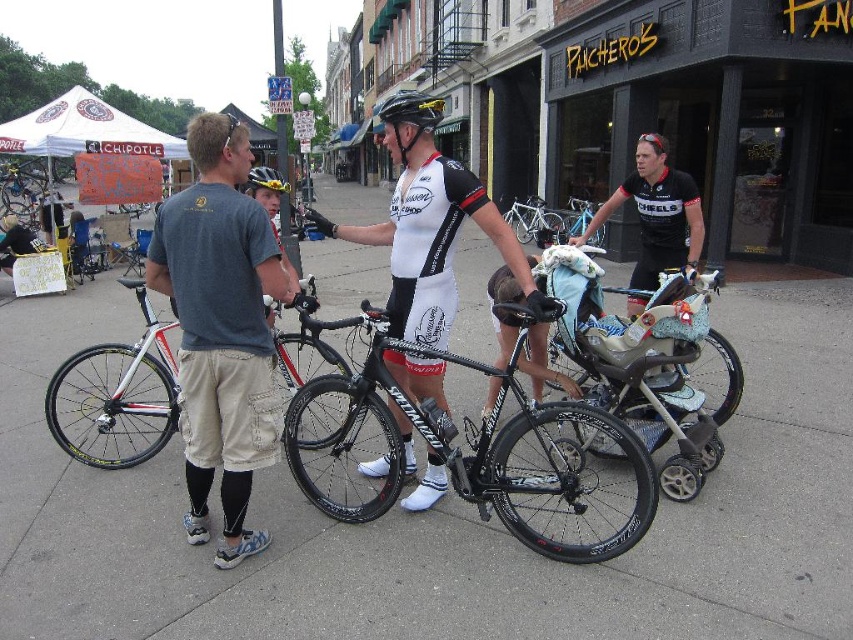
Does shiny black frame at center have a greater height compared to white matte cycling jersey at center?

Correct, shiny black frame at center is much taller as white matte cycling jersey at center.

This screenshot has height=640, width=853. I want to click on shiny black frame at center, so click(469, 445).

Locate an element on the screen. This screenshot has width=853, height=640. shiny black frame at center is located at coordinates (469, 445).

Does gray concrete pavement at center appear on the right side of white matte bicycle at left?

Indeed, gray concrete pavement at center is positioned on the right side of white matte bicycle at left.

Who is more forward, [810,340] or [70,440]?

Point [70,440] is in front.

Is point (144, 481) closer to viewer compared to point (149, 449)?

Yes, point (144, 481) is in front of point (149, 449).

Where is `gray concrete pavement at center`? The image size is (853, 640). gray concrete pavement at center is located at coordinates (440, 518).

Consider the image. Does white matte cycling jersey at center appear on the right side of shiny black helmet at center?

Correct, you'll find white matte cycling jersey at center to the right of shiny black helmet at center.

What do you see at coordinates (431, 240) in the screenshot? I see `white matte cycling jersey at center` at bounding box center [431, 240].

Where is `white matte cycling jersey at center`? The height and width of the screenshot is (640, 853). white matte cycling jersey at center is located at coordinates (431, 240).